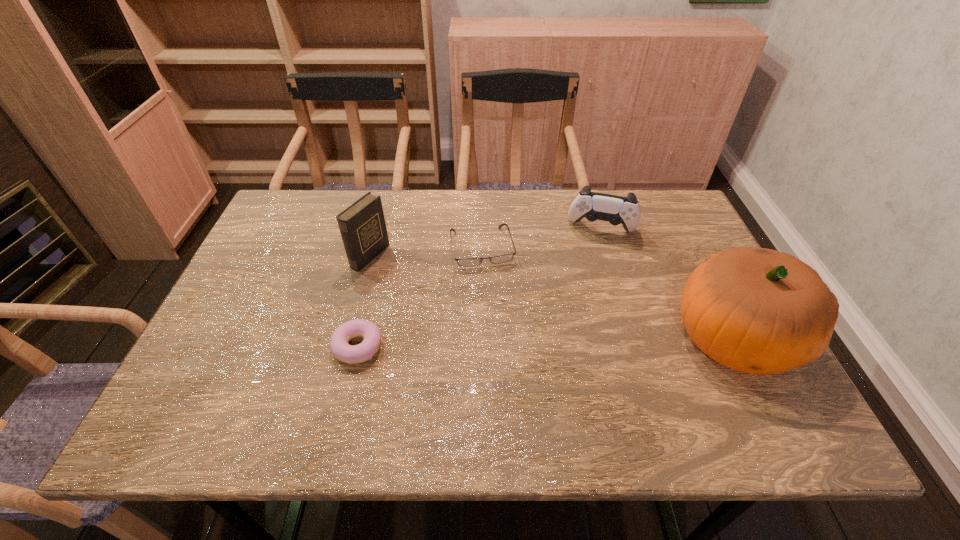
You are a GUI agent. You are given a task and a screenshot of the screen. Output one action in this format:
    pyautogui.click(x=<x>, y=<y>)
    Task: Click on the vacant spot on the desktop that is between the doughnut and the pumpkin and is positioned on the front cover of the diary
    Image resolution: width=960 pixels, height=540 pixels.
    Given the screenshot: What is the action you would take?
    pyautogui.click(x=564, y=342)

The image size is (960, 540). What are the coordinates of `free spot on the desktop that is between the doughnut and the tallest object and is positioned on the front-facing side of the third object from right to left` in the screenshot? It's located at (505, 343).

Locate an element on the screen. Image resolution: width=960 pixels, height=540 pixels. free space on the desktop that is between the doughnut and the tallest object and is positioned on the front-facing side of the control is located at coordinates (586, 341).